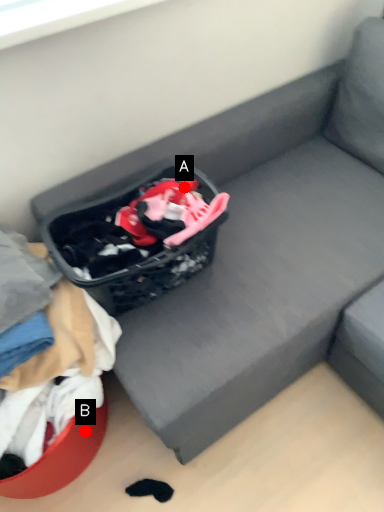
Question: Two points are circled on the image, labeled by A and B beside each circle. Which point is further to the camera?

Choices:
 (A) A is further
 (B) B is further

Answer: (B)